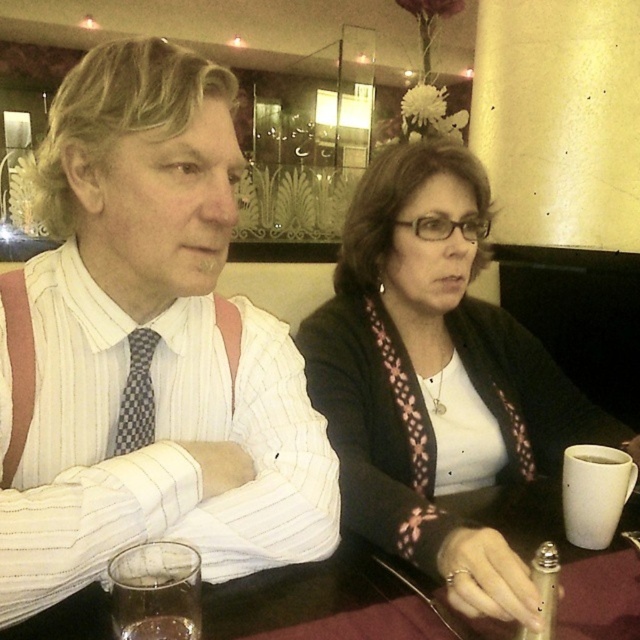
Does point (289, 449) lie behind point (129, 355)?

Yes.

Which is behind, point (168, 83) or point (136, 433)?

The point (136, 433) is more distant.

Who is more forward, (266,557) or (147,330)?

Positioned in front is point (266,557).

At what (x,y) coordinates should I click in order to perform the action: click on white striped shirt at center. Please return your answer as a coordinate pair (x, y). Looking at the image, I should click on (154, 349).

Who is higher up, white matte sweater at center or checkered fabric tie at left?

checkered fabric tie at left is above.

Which of these two, white matte sweater at center or checkered fabric tie at left, stands shorter?

Standing shorter between the two is checkered fabric tie at left.

Does point (452, 166) lie behind point (138, 381)?

Yes.

You are a GUI agent. You are given a task and a screenshot of the screen. Output one action in this format:
    pyautogui.click(x=<x>, y=<y>)
    Task: Click on the white matte sweater at center
    This screenshot has height=640, width=640.
    Given the screenshot: What is the action you would take?
    pyautogui.click(x=436, y=380)

Between white striped shirt at center and translucent glass at lower left, which one has more height?

With more height is white striped shirt at center.

Who is more forward, (64, 413) or (170, 554)?

Point (170, 554) is more forward.

Where is `white striped shirt at center`? white striped shirt at center is located at coordinates (154, 349).